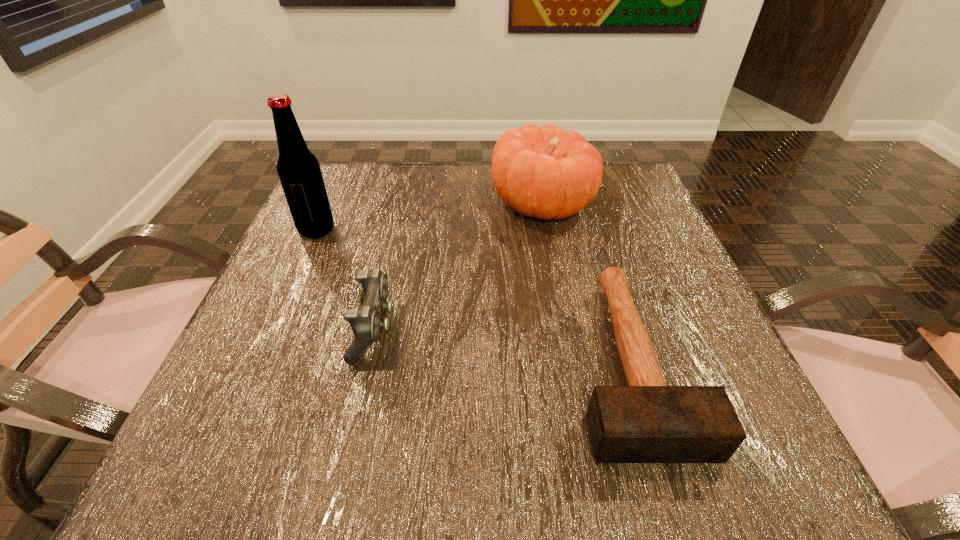
Identify the location of the tallest object. (298, 169).

At what (x,y) coordinates should I click in order to perform the action: click on the leftmost object. Please return your answer as a coordinate pair (x, y). Looking at the image, I should click on (298, 169).

The height and width of the screenshot is (540, 960). I want to click on pumpkin, so click(546, 173).

This screenshot has width=960, height=540. Find the location of `the second object from left to right`. the second object from left to right is located at coordinates (366, 322).

Identify the location of control. pos(366,322).

Find the location of a particular element. This screenshot has height=540, width=960. mallet is located at coordinates (647, 421).

The height and width of the screenshot is (540, 960). Find the location of `vacant space situated 0.270m on the right of the beer bottle`. vacant space situated 0.270m on the right of the beer bottle is located at coordinates (461, 230).

Identify the location of vacant region located on the front of the third shortest object. The width and height of the screenshot is (960, 540). (563, 312).

The width and height of the screenshot is (960, 540). What are the coordinates of `free space located on the surface of the control with buttons` in the screenshot? It's located at (494, 330).

The height and width of the screenshot is (540, 960). I want to click on object that is at the far edge, so click(x=546, y=173).